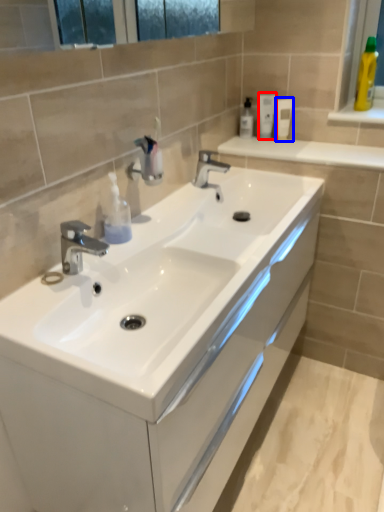
Question: Which point is closer to the camera, mouthwash (highlighted by a red box) or mouthwash (highlighted by a blue box)?

Choices:
 (A) mouthwash
 (B) mouthwash

Answer: (B)